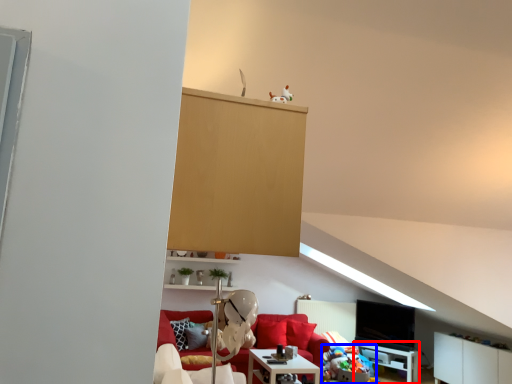
Question: Which object is further to the camera taking this photo, table (highlighted by a red box) or stuff (highlighted by a blue box)?

Choices:
 (A) table
 (B) stuff

Answer: (A)